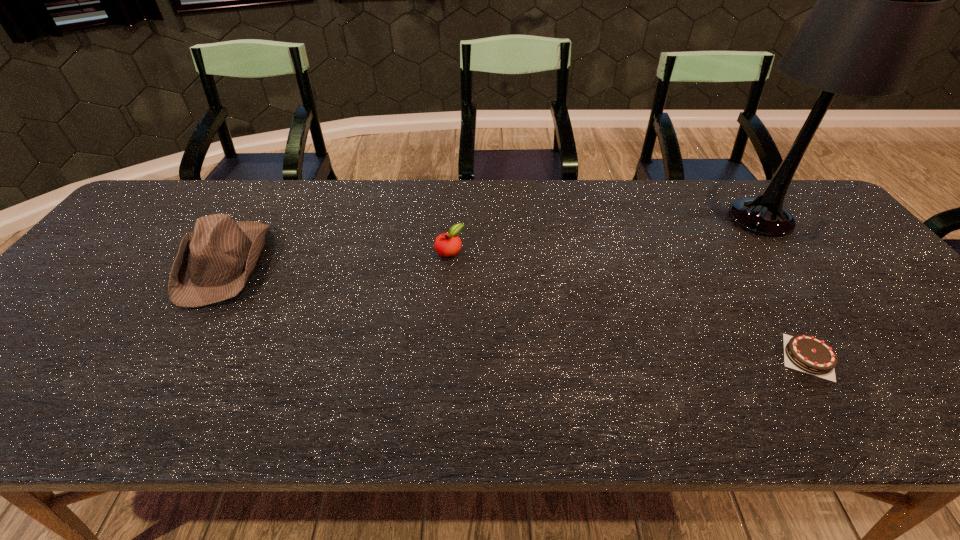
The width and height of the screenshot is (960, 540). What are the coordinates of `vacant space that is in between the fedora and the third object from right to left` in the screenshot? It's located at (336, 257).

At what (x,y) coordinates should I click in order to perform the action: click on vacant point located between the nearest object and the second shortest object. Please return your answer as a coordinate pair (x, y). Image resolution: width=960 pixels, height=540 pixels. Looking at the image, I should click on (629, 303).

You are a GUI agent. You are given a task and a screenshot of the screen. Output one action in this format:
    pyautogui.click(x=<x>, y=<y>)
    Task: Click on the unoccupied area between the third shortest object and the table lamp
    
    Given the screenshot: What is the action you would take?
    pyautogui.click(x=492, y=241)

You are a GUI agent. You are given a task and a screenshot of the screen. Output one action in this format:
    pyautogui.click(x=<x>, y=<y>)
    Task: Click on the free space between the leftmost object and the tallest object
    Image resolution: width=960 pixels, height=540 pixels.
    Given the screenshot: What is the action you would take?
    pyautogui.click(x=492, y=241)

In order to click on vacant region between the chocolate cake and the second shortest object in this screenshot , I will do `click(629, 303)`.

Locate an element on the screen. vacant area that lies between the leftmost object and the third object from right to left is located at coordinates click(x=336, y=257).

I want to click on blank region between the tallest object and the third shortest object, so click(492, 241).

Find the location of `vacant area that lies between the chocolate cake and the tallest object`. vacant area that lies between the chocolate cake and the tallest object is located at coordinates [x=784, y=287].

At what (x,y) coordinates should I click in order to perform the action: click on vacant area that lies between the chocolate cake and the tallest object. Please return your answer as a coordinate pair (x, y). This screenshot has width=960, height=540. Looking at the image, I should click on (784, 287).

The image size is (960, 540). I want to click on free space between the fedora and the shortest object, so click(x=516, y=310).